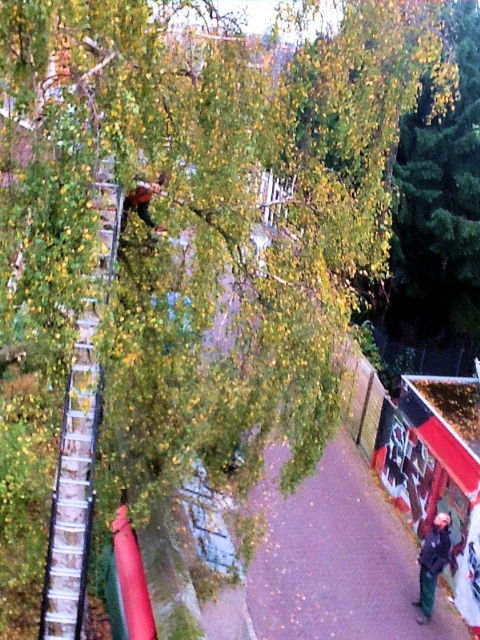
Question: Based on their relative distances, which object is farther from the metallic silver ladder at center-left?

Choices:
 (A) metallic red skateboard at upper center
 (B) dark green pants at lower right

Answer: (B)

Question: Is the position of metallic silver ladder at center-left more distant than that of metallic red skateboard at upper center?

Choices:
 (A) no
 (B) yes

Answer: (A)

Question: Which point is farther to the camera?

Choices:
 (A) (86, 474)
 (B) (135, 196)

Answer: (B)

Question: Considering the relative positions of metallic silver ladder at center-left and metallic red skateboard at upper center in the image provided, where is metallic silver ladder at center-left located with respect to metallic red skateboard at upper center?

Choices:
 (A) above
 (B) below

Answer: (B)

Question: Can you confirm if metallic silver ladder at center-left is positioned above dark green pants at lower right?

Choices:
 (A) no
 (B) yes

Answer: (B)

Question: Based on their relative distances, which object is nearer to the dark green pants at lower right?

Choices:
 (A) metallic silver ladder at center-left
 (B) metallic red skateboard at upper center

Answer: (A)